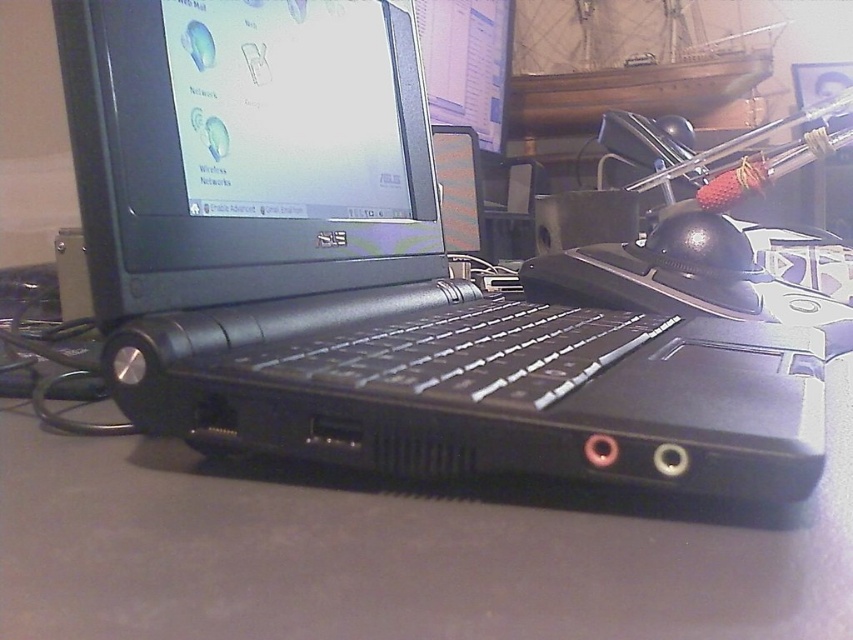
Can you confirm if black plastic laptop at center is positioned below black matte keyboard at center?

Actually, black plastic laptop at center is above black matte keyboard at center.

Which is in front, point (490, 348) or point (416, 376)?

Point (416, 376)

Image resolution: width=853 pixels, height=640 pixels. I want to click on black plastic laptop at center, so 370,275.